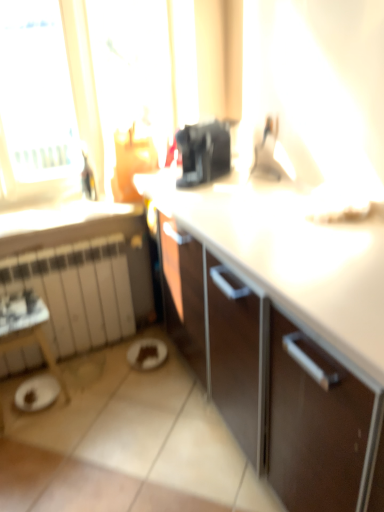
At what (x,y) coordinates should I click in order to perform the action: click on free spot to the right of white matte radiator at lower left. Please return your answer as a coordinate pair (x, y). The width and height of the screenshot is (384, 512). Looking at the image, I should click on (145, 375).